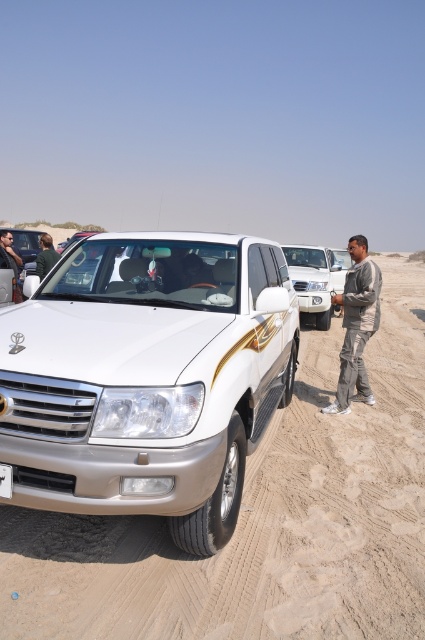
You are a hiker trying to cross the desert. You see the white sand dirt track at center and the gray cotton pants at right. Which object is shorter in height?

The white sand dirt track at center is not as tall as the gray cotton pants at right, so the dirt track is shorter in height.

You are a driver who just arrived at the desert and see the white metallic suv at center and the white sand dirt track at center. Which one is positioned to the left of the other?

The white sand dirt track at center is positioned to the left of the white metallic suv at center.

You are a driver who just arrived at this desert location. You notice the white sand dirt track at center and the white plastic license plate at center. Which object is higher up from the ground?

The white sand dirt track at center is much taller than the white plastic license plate at center, so the white sand dirt track at center is higher up from the ground.